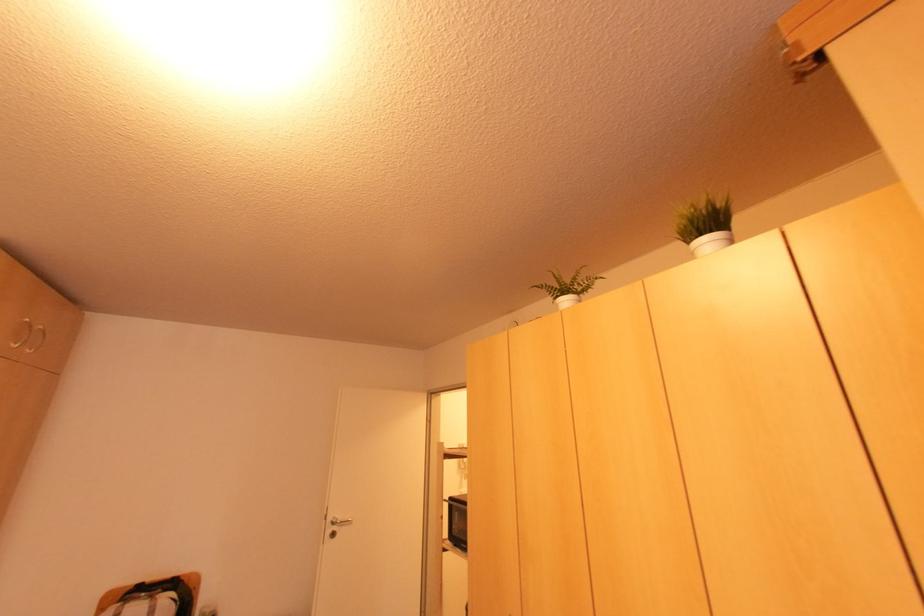
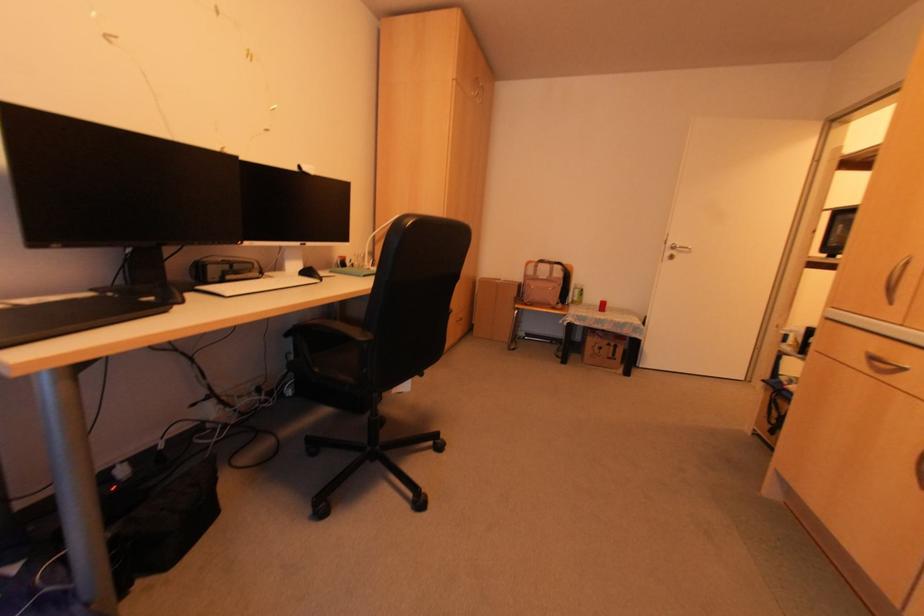
The point at [332,517] is marked in the first image. Where is the corresponding point in the second image?

(671, 245)